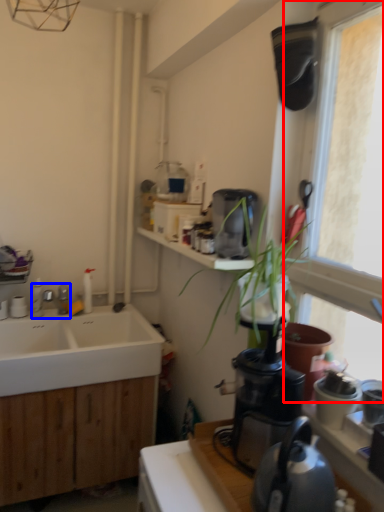
Question: Which object appears farthest to the camera in this image, window (highlighted by a red box) or tap (highlighted by a blue box)?

Choices:
 (A) window
 (B) tap

Answer: (B)